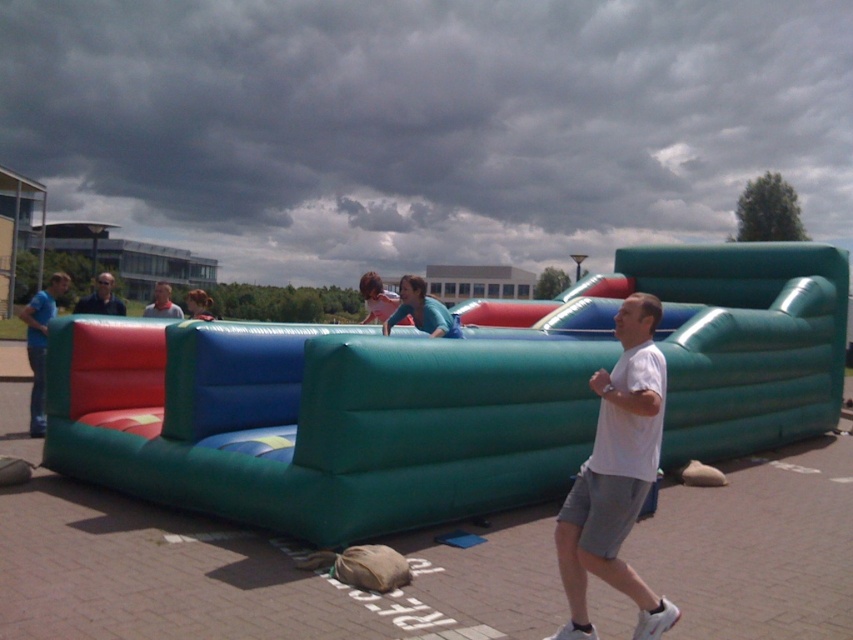
Does white matte t-shirt at center appear on the right side of matte black sunglasses at upper left?

Correct, you'll find white matte t-shirt at center to the right of matte black sunglasses at upper left.

Is point (640, 608) farther from viewer compared to point (97, 304)?

No, (640, 608) is in front of (97, 304).

Image resolution: width=853 pixels, height=640 pixels. I want to click on white matte t-shirt at center, so click(616, 477).

The height and width of the screenshot is (640, 853). In order to click on white matte t-shirt at center in this screenshot , I will do `click(616, 477)`.

Does white matte t-shirt at center appear under blue t-shirt at left?

Indeed, white matte t-shirt at center is positioned under blue t-shirt at left.

Can you confirm if white matte t-shirt at center is positioned to the left of blue t-shirt at left?

No, white matte t-shirt at center is not to the left of blue t-shirt at left.

Image resolution: width=853 pixels, height=640 pixels. What do you see at coordinates (616, 477) in the screenshot?
I see `white matte t-shirt at center` at bounding box center [616, 477].

In order to click on white matte t-shirt at center in this screenshot , I will do `click(616, 477)`.

Who is more forward, (33, 365) or (155, 305)?

Point (33, 365) is more forward.

Between blue t-shirt at left and matte white shirt at center, which one is positioned higher?

matte white shirt at center is above.

Is point (57, 284) less distant than point (163, 307)?

Yes, point (57, 284) is in front of point (163, 307).

Identify the location of blue t-shirt at left. 39,344.